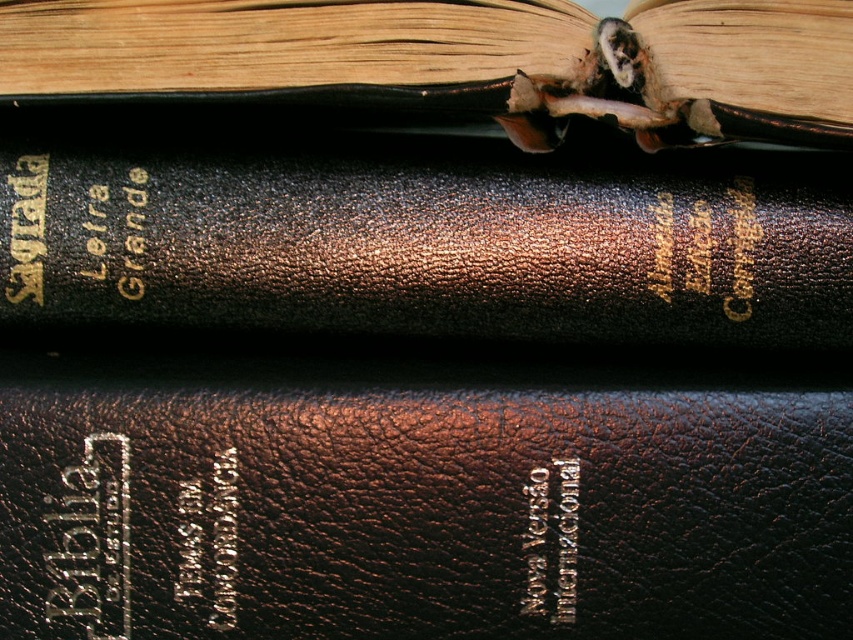
Question: Does leather-bound book at center have a greater width compared to leather-bound book at upper center?

Choices:
 (A) no
 (B) yes

Answer: (B)

Question: Is brown leather book at center above leather-bound book at center?

Choices:
 (A) no
 (B) yes

Answer: (A)

Question: Which object appears closest to the camera in this image?

Choices:
 (A) leather-bound book at center
 (B) brown leather book at center
 (C) leather-bound book at upper center

Answer: (C)

Question: Which point is farther to the camera?

Choices:
 (A) (680, 486)
 (B) (776, 125)
 (C) (801, 212)

Answer: (C)

Question: Observing the image, what is the correct spatial positioning of brown leather book at center in reference to leather-bound book at upper center?

Choices:
 (A) left
 (B) right

Answer: (B)

Question: Which object appears closest to the camera in this image?

Choices:
 (A) leather-bound book at center
 (B) leather-bound book at upper center
 (C) brown leather book at center

Answer: (B)